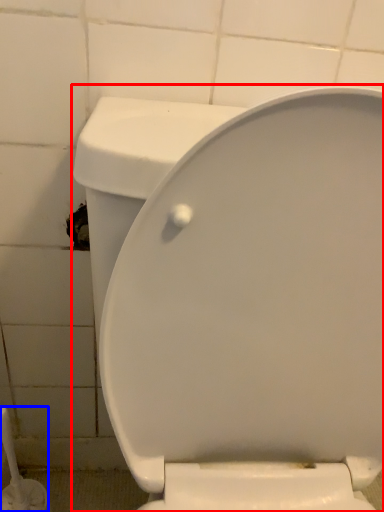
Question: Which object appears closest to the camera in this image, toilet (highlighted by a red box) or brush (highlighted by a blue box)?

Choices:
 (A) toilet
 (B) brush

Answer: (A)